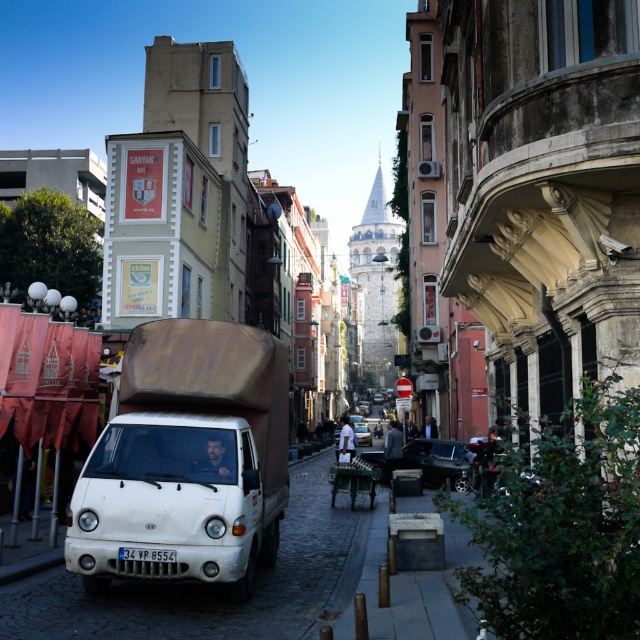
Question: Does white matte truck at lower left lie in front of white matte car at center?

Choices:
 (A) no
 (B) yes

Answer: (B)

Question: Which object is closer to the camera taking this photo?

Choices:
 (A) shiny black car at right
 (B) white plastic license plate at center
 (C) white matte truck at lower left
 (D) metallic silver car at center

Answer: (B)

Question: Is white matte truck at lower left behind metallic silver car at center?

Choices:
 (A) no
 (B) yes

Answer: (A)

Question: Which point is closer to the camera?

Choices:
 (A) white matte truck at lower left
 (B) metallic silver car at center
 (C) white plastic license plate at center
 (D) shiny black car at right

Answer: (C)

Question: Is shiny black car at right smaller than metallic silver car at center?

Choices:
 (A) yes
 (B) no

Answer: (A)

Question: Which is nearer to the white plastic license plate at center?

Choices:
 (A) metallic silver car at center
 (B) white matte car at center
 (C) white matte truck at lower left

Answer: (C)